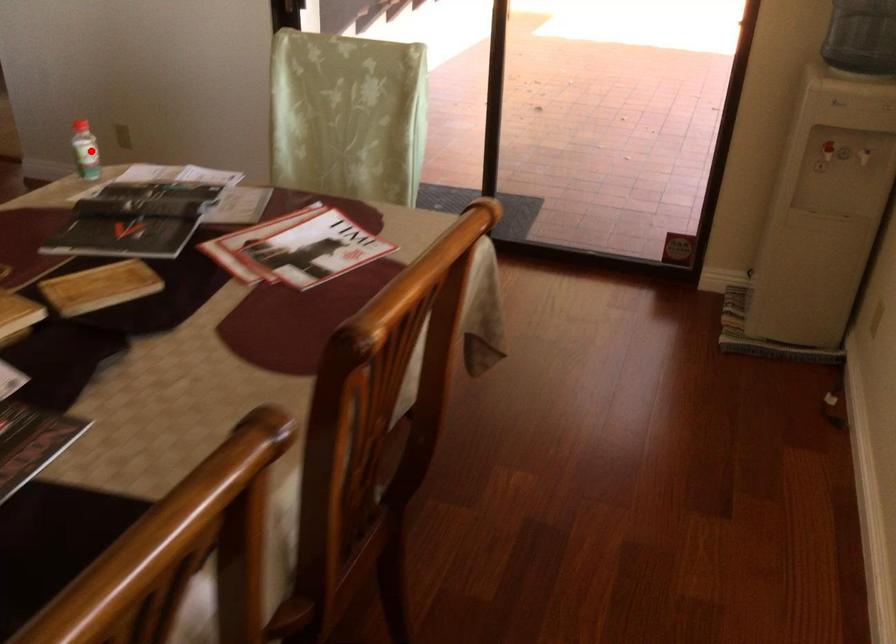
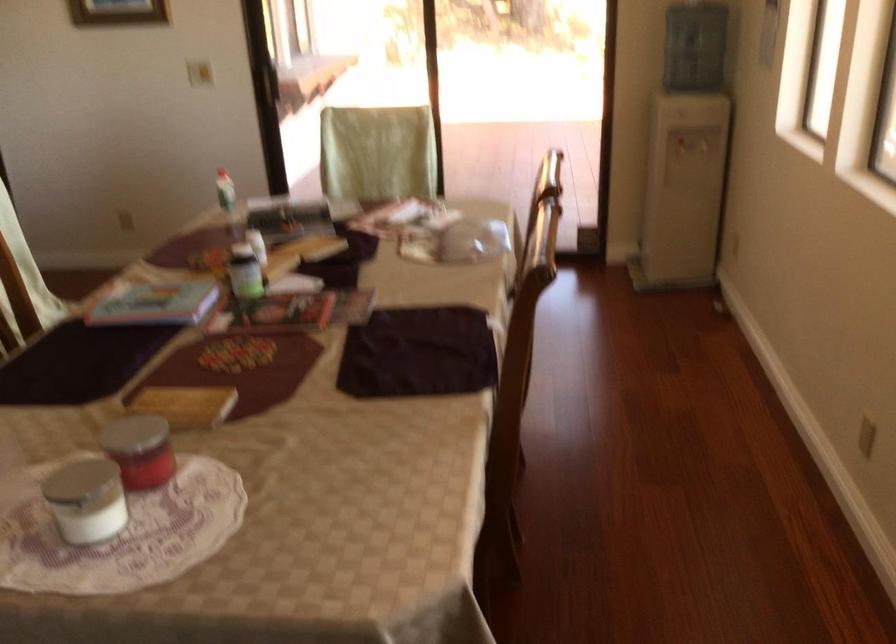
Question: I am providing you with two images of the same scene from different viewpoints. In image1, a red point is highlighted. Considering the same 3D point in image2, which of the following is correct?

Choices:
 (A) It is closer
 (B) It is farther

Answer: (B)